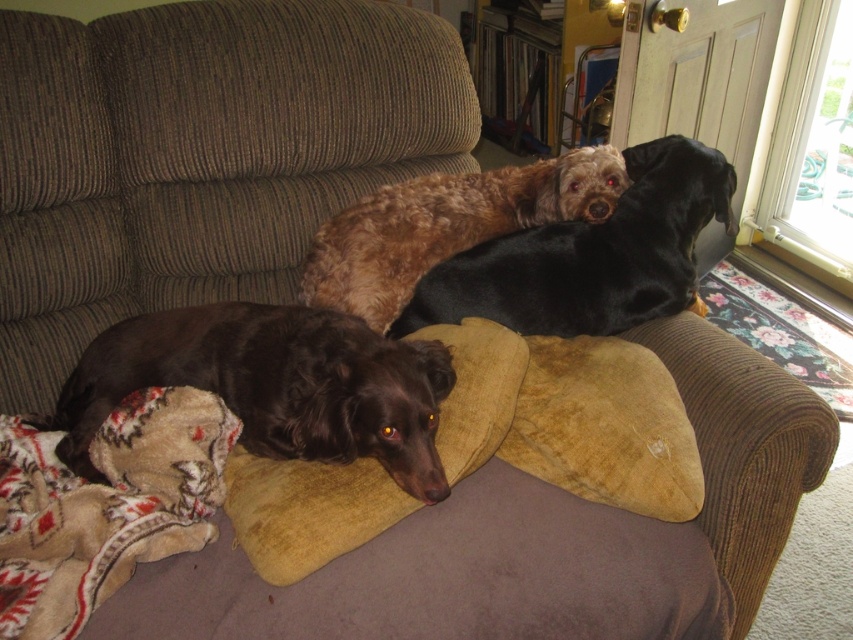
Question: Is shaggy brown dog at upper center in front of suede-like tan pillow at center?

Choices:
 (A) no
 (B) yes

Answer: (A)

Question: Does shiny brown dog at lower left appear under fuzzy beige blanket at lower left?

Choices:
 (A) no
 (B) yes

Answer: (A)

Question: Which point is closer to the camera?

Choices:
 (A) suede-like tan pillow at center
 (B) shaggy brown dog at upper center
 (C) fuzzy beige blanket at lower left

Answer: (C)

Question: Which point appears closest to the camera in this image?

Choices:
 (A) (111, 561)
 (B) (648, 154)

Answer: (A)

Question: Which point is closer to the camera?

Choices:
 (A) (135, 376)
 (B) (73, 580)
 (C) (589, 484)
 (D) (465, 273)

Answer: (B)

Question: Can you confirm if fuzzy beige blanket at lower left is positioned below shaggy brown dog at upper center?

Choices:
 (A) yes
 (B) no

Answer: (A)